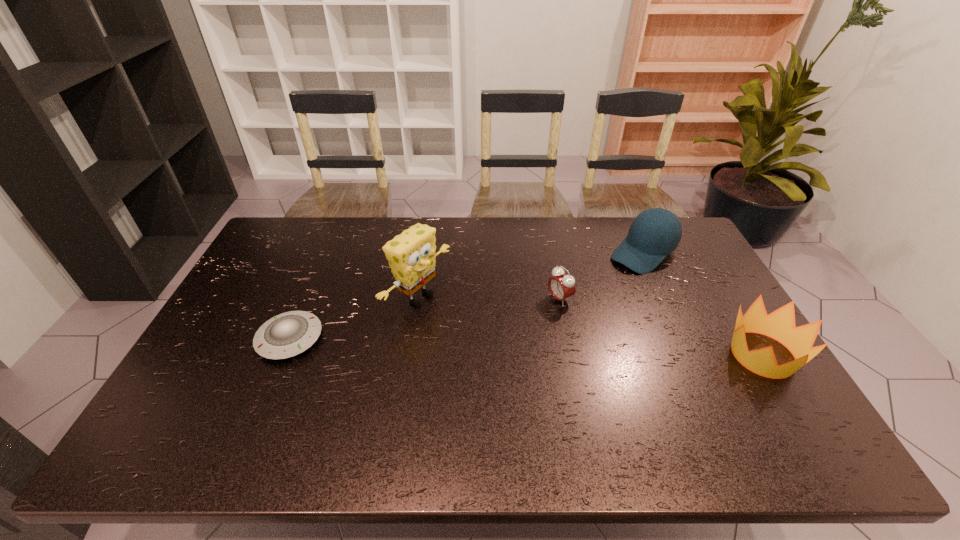
At what (x,y) coordinates should I click in order to perform the action: click on vacant space on the desktop that is between the leftmost object and the crown and is positioned on the clock face of the third object from left to right. Please return your answer as a coordinate pair (x, y). The image size is (960, 540). Looking at the image, I should click on pos(468,345).

Identify the location of free space on the desktop that is between the leftmost object and the crown and is positioned on the face of the sponge. (506, 346).

This screenshot has width=960, height=540. Find the location of `vacant space on the desktop that is between the shortest object and the crown and is positioned on the front-facing side of the baseball cap`. vacant space on the desktop that is between the shortest object and the crown and is positioned on the front-facing side of the baseball cap is located at coordinates (519, 347).